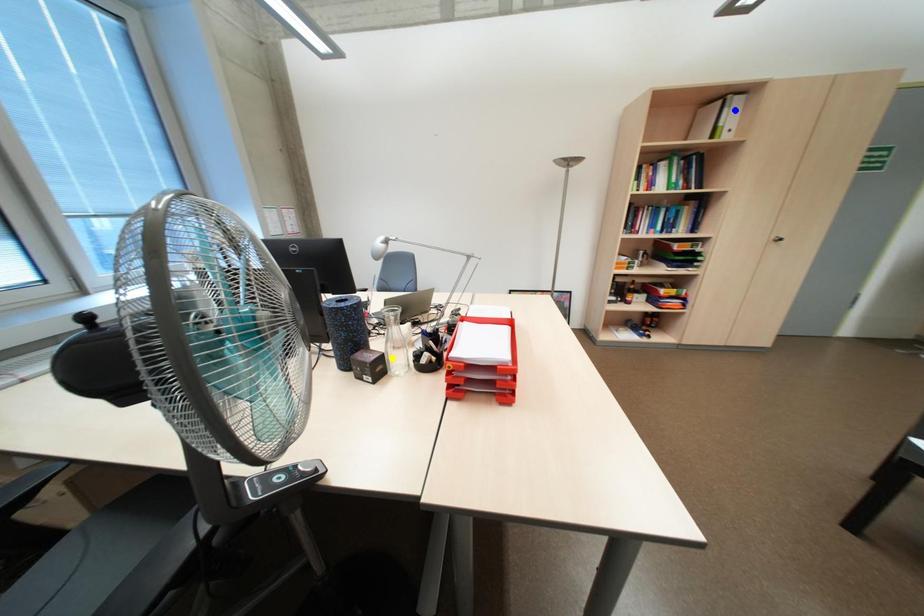
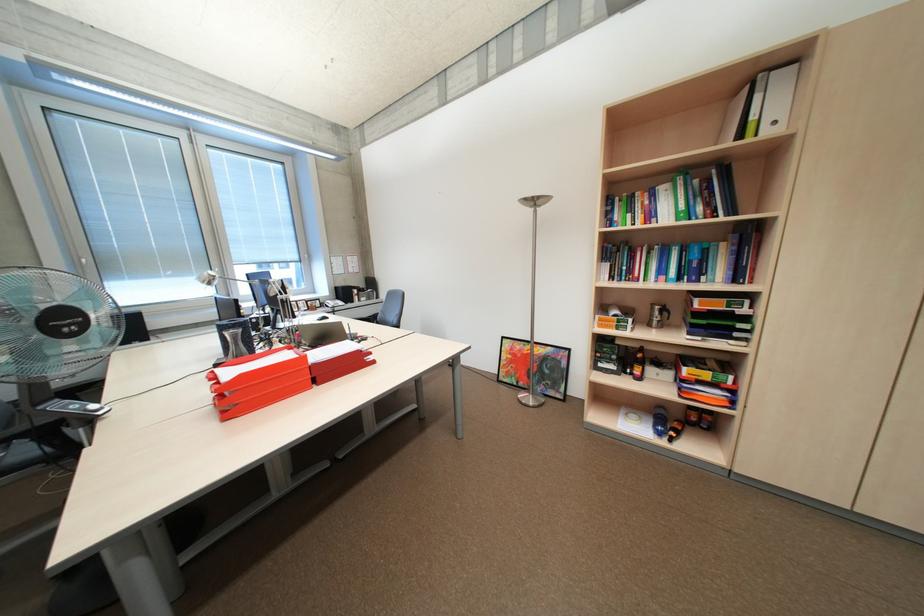
I am providing you with two images of the same scene from different viewpoints. Three points are marked in image1. Which point corresponds to a part or object that is occluded in image2?In image1, three points are marked. Which of them correspond to a part or object that is occluded in image2?Among the three points shown in image1, which one corresponds to a part or object that is no longer visible due to occlusion in image2?

green point, yellow point cannot be seen in image2.